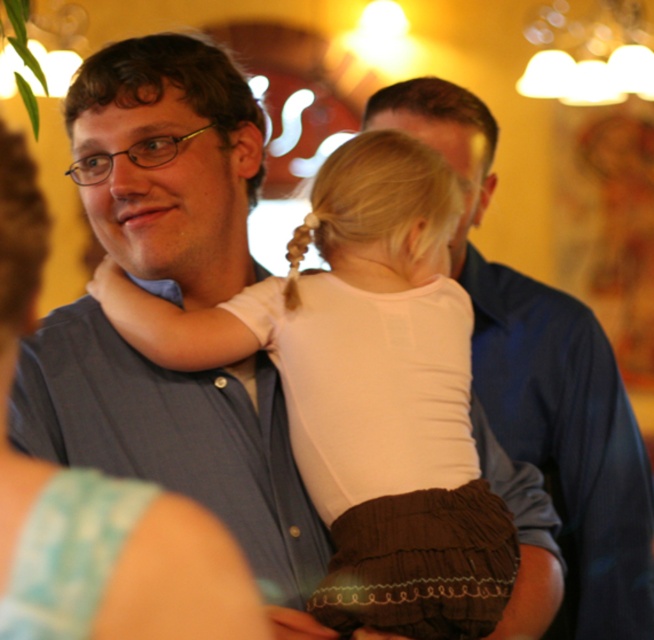
Question: Does white cotton shirt at center appear on the left side of white fabric at left?

Choices:
 (A) no
 (B) yes

Answer: (A)

Question: Which point appears closest to the camera in this image?

Choices:
 (A) (131, 195)
 (B) (356, 204)

Answer: (A)

Question: In this image, where is white cotton shirt at center located relative to white fabric at left?

Choices:
 (A) left
 (B) right

Answer: (B)

Question: Which point appears closest to the camera in this image?

Choices:
 (A) (436, 230)
 (B) (99, 109)

Answer: (B)

Question: Which point is closer to the camera?

Choices:
 (A) [x=112, y=212]
 (B) [x=366, y=532]

Answer: (B)

Question: Can you confirm if white cotton shirt at center is positioned below white fabric at left?

Choices:
 (A) no
 (B) yes

Answer: (B)